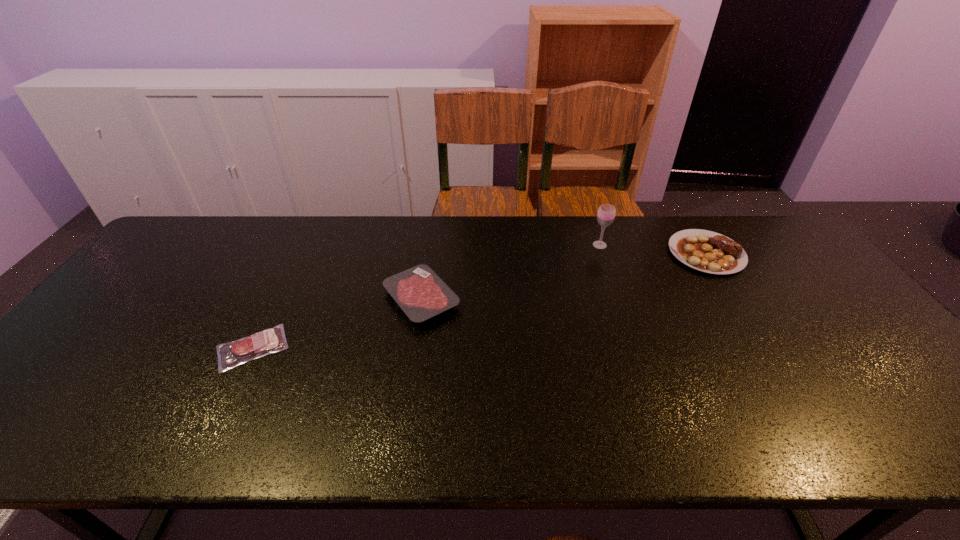
You are a GUI agent. You are given a task and a screenshot of the screen. Output one action in this format:
    pyautogui.click(x=<x>, y=<y>)
    Task: Click on the steak that can be found as the closest to the second object from right to left
    This screenshot has height=540, width=960.
    Given the screenshot: What is the action you would take?
    pyautogui.click(x=703, y=250)

Locate which steak ranks second in proximity to the leftmost steak. Please provide its 2D coordinates. Your answer should be formatted as a tuple, i.e. [(x, y)], where the tuple contains the x and y coordinates of a point satisfying the conditions above.

[(703, 250)]

At what (x,y) coordinates should I click in order to perform the action: click on free space that satisfies the following two spatial constraints: 1. on the back side of the tallest object; 2. on the left side of the leftmost object. Please return your answer as a coordinate pair (x, y). Looking at the image, I should click on (304, 245).

Where is `vacant point that satisfies the following two spatial constraints: 1. on the back side of the tallest object; 2. on the right side of the shortest steak`? The height and width of the screenshot is (540, 960). vacant point that satisfies the following two spatial constraints: 1. on the back side of the tallest object; 2. on the right side of the shortest steak is located at coordinates (304, 245).

The width and height of the screenshot is (960, 540). Identify the location of vacant point that satisfies the following two spatial constraints: 1. on the back side of the third object from left to right; 2. on the left side of the leftmost steak. (304, 245).